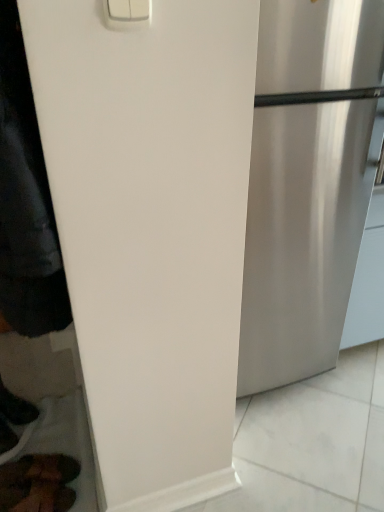
Question: Is black matte jacket at left in front of satin silver refrigerator at right?

Choices:
 (A) no
 (B) yes

Answer: (B)

Question: Is black matte jacket at left touching satin silver refrigerator at right?

Choices:
 (A) no
 (B) yes

Answer: (A)

Question: Is black matte jacket at left facing towards satin silver refrigerator at right?

Choices:
 (A) yes
 (B) no

Answer: (B)

Question: Is black matte jacket at left outside of satin silver refrigerator at right?

Choices:
 (A) no
 (B) yes

Answer: (B)

Question: From the image's perspective, is black matte jacket at left located beneath satin silver refrigerator at right?

Choices:
 (A) no
 (B) yes

Answer: (A)

Question: Considering the positions of brown leather shoes at lower left and satin silver refrigerator at right in the image, is brown leather shoes at lower left bigger or smaller than satin silver refrigerator at right?

Choices:
 (A) big
 (B) small

Answer: (B)

Question: Do you think brown leather shoes at lower left is within satin silver refrigerator at right, or outside of it?

Choices:
 (A) inside
 (B) outside

Answer: (B)

Question: Is brown leather shoes at lower left wider or thinner than satin silver refrigerator at right?

Choices:
 (A) thin
 (B) wide

Answer: (A)

Question: Is brown leather shoes at lower left taller or shorter than satin silver refrigerator at right?

Choices:
 (A) short
 (B) tall

Answer: (A)

Question: Considering the positions of black matte jacket at left and satin silver refrigerator at right in the image, is black matte jacket at left taller or shorter than satin silver refrigerator at right?

Choices:
 (A) short
 (B) tall

Answer: (A)

Question: From the image's perspective, relative to satin silver refrigerator at right, is black matte jacket at left above or below?

Choices:
 (A) above
 (B) below

Answer: (A)

Question: From a real-world perspective, is black matte jacket at left physically located above or below satin silver refrigerator at right?

Choices:
 (A) above
 (B) below

Answer: (A)

Question: Looking at their shapes, would you say black matte jacket at left is wider or thinner than satin silver refrigerator at right?

Choices:
 (A) thin
 (B) wide

Answer: (A)

Question: From a real-world perspective, is black leather shoe at lower left physically located above or below brown leather shoes at lower left?

Choices:
 (A) below
 (B) above

Answer: (B)

Question: Considering the positions of black leather shoe at lower left and brown leather shoes at lower left in the image, is black leather shoe at lower left bigger or smaller than brown leather shoes at lower left?

Choices:
 (A) small
 (B) big

Answer: (B)